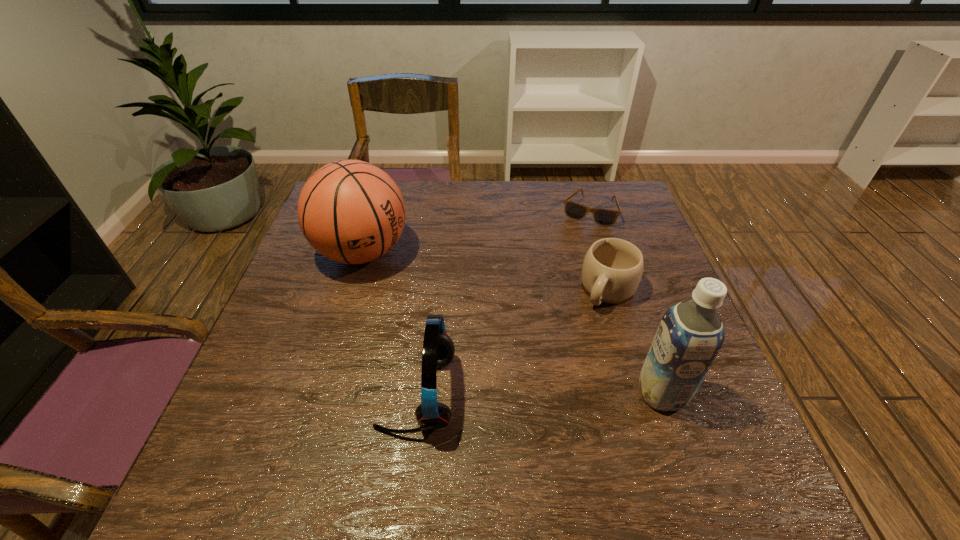
Locate an element on the screen. The width and height of the screenshot is (960, 540). object present at the near right corner is located at coordinates (690, 335).

This screenshot has width=960, height=540. In order to click on free region at the far edge in this screenshot , I will do coord(452,187).

In the image, there is a desktop. Where is `vacant space at the near edge`? The height and width of the screenshot is (540, 960). vacant space at the near edge is located at coordinates (499, 434).

The image size is (960, 540). In the image, there is a desktop. Find the location of `blank space at the left edge`. blank space at the left edge is located at coordinates (324, 335).

What are the coordinates of `vacant point at the right edge` in the screenshot? It's located at (665, 288).

The width and height of the screenshot is (960, 540). In order to click on vacant space at the near left corner of the desktop in this screenshot , I will do `click(278, 436)`.

What are the coordinates of `vacant space at the far right corner of the desktop` in the screenshot? It's located at tap(630, 202).

The image size is (960, 540). Find the location of `vacant space at the near right corner`. vacant space at the near right corner is located at coordinates point(731,412).

I want to click on free space between the basketball and the headset, so click(390, 323).

Identify the location of blank region between the basketball and the shortest object. (475, 232).